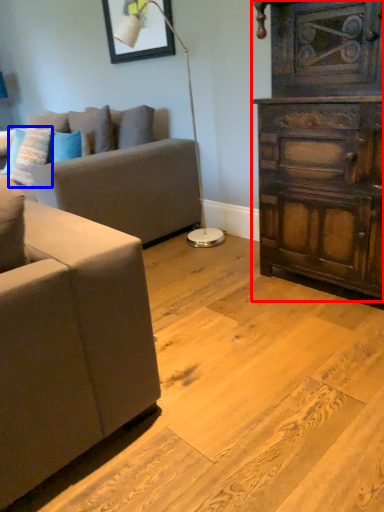
Question: Among these objects, which one is nearest to the camera, chest of drawers (highlighted by a red box) or pillow (highlighted by a blue box)?

Choices:
 (A) chest of drawers
 (B) pillow

Answer: (A)